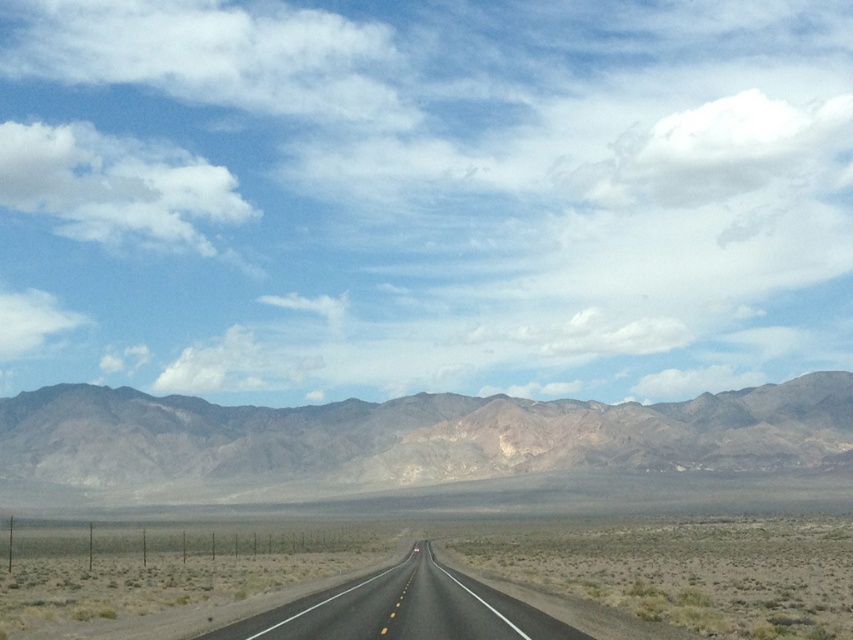
You are driving a car and see the brown rocky mountain at center and the black asphalt road at center ahead. Which one is positioned lower in the image?

The brown rocky mountain at center is located below the black asphalt road at center, so it is positioned lower in the image.

You are a hiker planning to take a photo of the brown rocky mountain at center and the black asphalt road at center from the same distance. Which object will appear smaller in your photo?

The brown rocky mountain at center is much taller than the black asphalt road at center, so the black asphalt road at center will appear smaller in the photo.